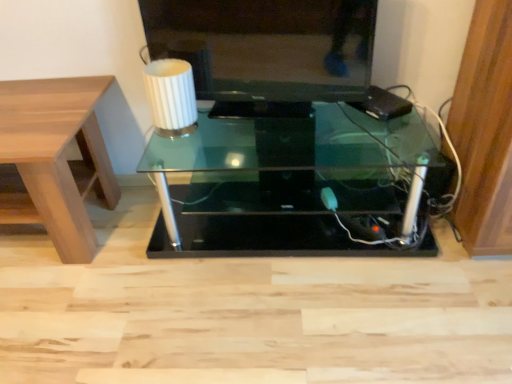
Question: From the image's perspective, relative to light brown wood table at left, the second table viewed from the right, is white ribbed glass at upper center above or below?

Choices:
 (A) above
 (B) below

Answer: (A)

Question: Based on their sizes in the image, would you say white ribbed glass at upper center is bigger or smaller than light brown wood table at left, the second table viewed from the right?

Choices:
 (A) big
 (B) small

Answer: (B)

Question: Estimate the real-world distances between objects in this image. Which object is closer to the light brown wood table at left, the 1th table viewed from the left?

Choices:
 (A) matte black television at upper center
 (B) transparent glass table at center, which is the 1th table in right-to-left order
 (C) white ribbed glass at upper center

Answer: (C)

Question: Which object is positioned closest to the matte black television at upper center?

Choices:
 (A) white ribbed glass at upper center
 (B) light brown wood table at left, the 1th table viewed from the left
 (C) transparent glass table at center, which is the 1th table in right-to-left order

Answer: (A)